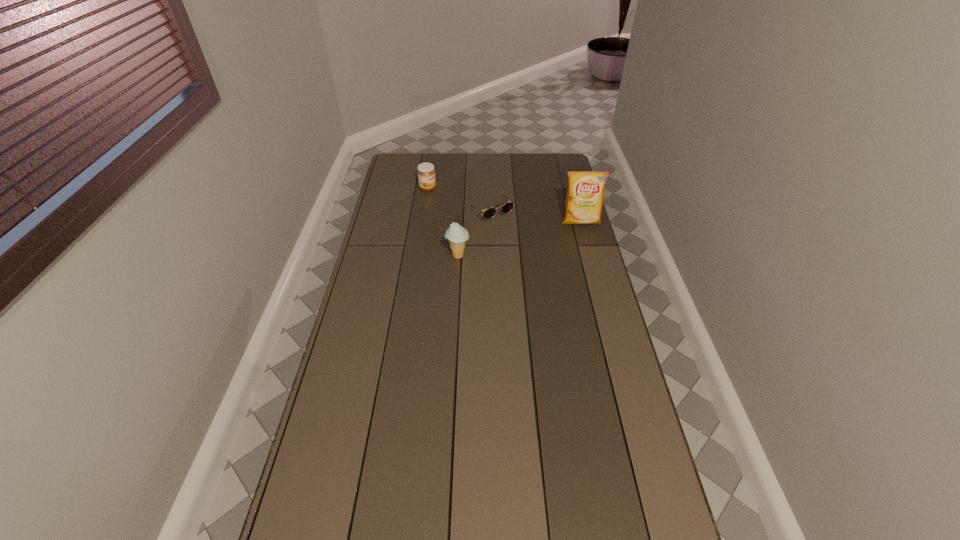
This screenshot has width=960, height=540. What are the coordinates of `free space on the desktop that is between the icecream and the crisp (potato chip) and is positioned on the front label of the farthest object` in the screenshot? It's located at (528, 237).

Locate an element on the screen. vacant space on the desktop that is between the nearest object and the tallest object and is positioned on the front lenses of the sunglasses is located at coordinates (516, 240).